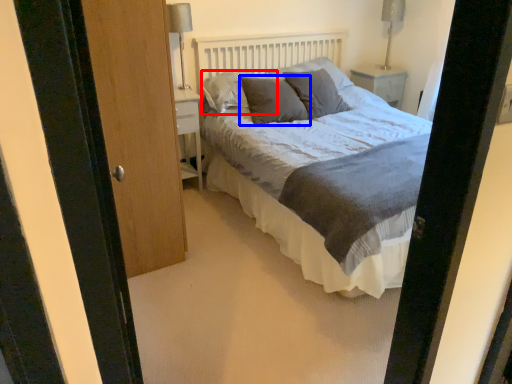
Question: Which object is closer to the camera taking this photo, pillow (highlighted by a red box) or pillow (highlighted by a blue box)?

Choices:
 (A) pillow
 (B) pillow

Answer: (B)